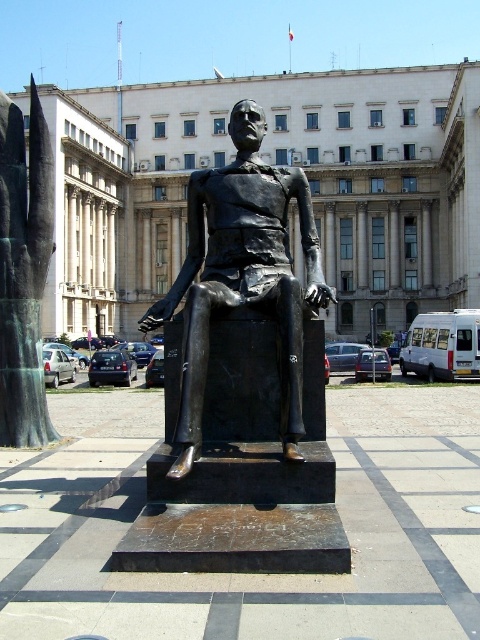
Is point (384, 244) positioned behind point (24, 253)?

Yes.

Consider the image. Is white marble building at center to the left of bronze statue at left from the viewer's perspective?

No, white marble building at center is not to the left of bronze statue at left.

What do you see at coordinates (276, 164) in the screenshot?
I see `white marble building at center` at bounding box center [276, 164].

Where is `white marble building at center`? white marble building at center is located at coordinates (276, 164).

Does white marble building at center have a smaller size compared to bronze statue at center?

Incorrect, white marble building at center is not smaller in size than bronze statue at center.

Does white marble building at center have a greater height compared to bronze statue at center?

Correct, white marble building at center is much taller as bronze statue at center.

What are the coordinates of `white marble building at center` in the screenshot? It's located at (276, 164).

Does bronze statue at center have a larger size compared to bronze statue at left?

No, bronze statue at center is not bigger than bronze statue at left.

Can you confirm if bronze statue at center is positioned below bronze statue at left?

Correct, bronze statue at center is located below bronze statue at left.

Is point (316, 256) behind point (0, 328)?

No, (316, 256) is in front of (0, 328).

Locate an element on the screen. This screenshot has height=640, width=480. bronze statue at center is located at coordinates (242, 275).